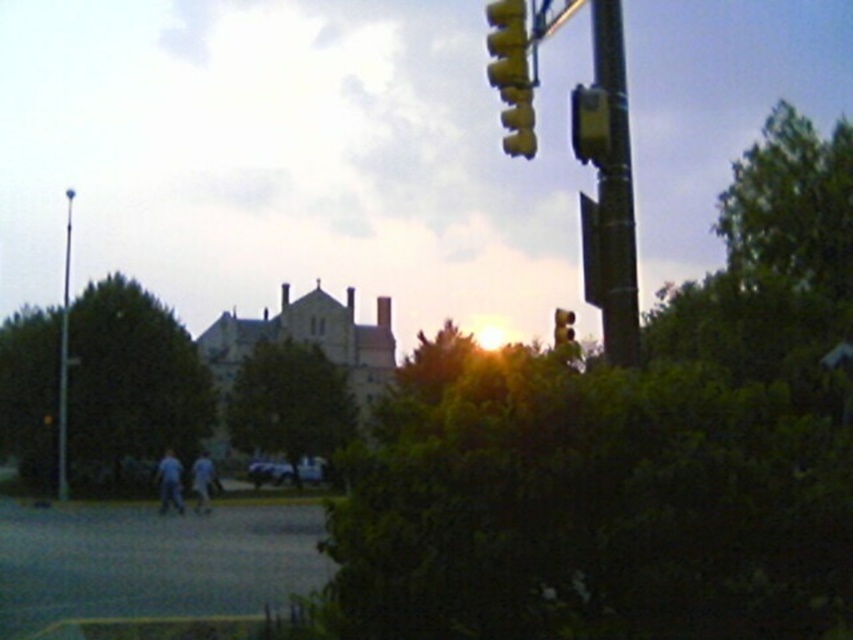
Question: Does green leafy tree at left have a larger size compared to blue jeans at lower left?

Choices:
 (A) no
 (B) yes

Answer: (B)

Question: Among these points, which one is nearest to the camera?

Choices:
 (A) (310, 458)
 (B) (199, 481)

Answer: (B)

Question: Which point appears farthest from the camera in this image?

Choices:
 (A) (556, 317)
 (B) (560, 557)
 (C) (512, 154)
 (D) (250, 440)

Answer: (D)

Question: Considering the relative positions of metallic blue car at center and yellow matte traffic light at upper center in the image provided, where is metallic blue car at center located with respect to yellow matte traffic light at upper center?

Choices:
 (A) above
 (B) below

Answer: (B)

Question: Can you confirm if green leafy tree at center is bigger than metallic blue car at center?

Choices:
 (A) yes
 (B) no

Answer: (A)

Question: Which point is closer to the camera?

Choices:
 (A) (474, 458)
 (B) (263, 472)
 (C) (296, 392)

Answer: (A)